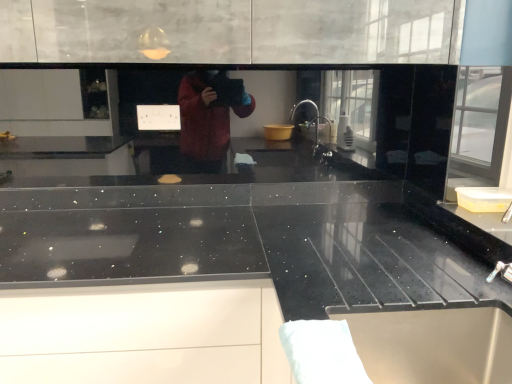
Find the location of a particular element. The image size is (512, 384). black granite countertop at lower left is located at coordinates (144, 334).

What do you see at coordinates (144, 334) in the screenshot?
I see `black granite countertop at lower left` at bounding box center [144, 334].

What is the approximate height of black granite countertop at lower left?

It is 30.79 inches.

Find the location of a particular element. black granite countertop at lower left is located at coordinates (144, 334).